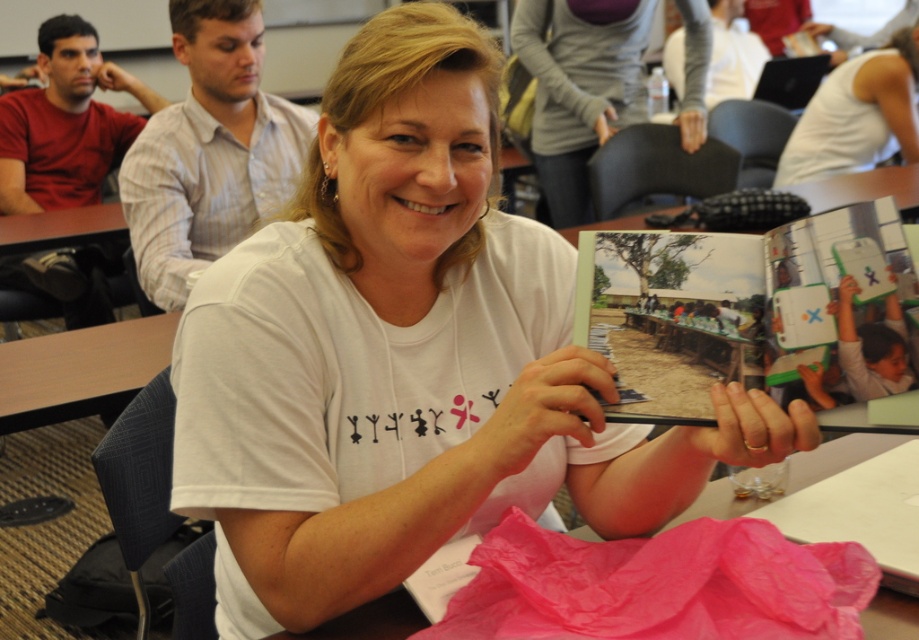
Is point (593, 253) positioned before point (112, 403)?

Yes, point (593, 253) is in front of point (112, 403).

Is green plastic book at center shorter than wooden table at lower left?

Indeed, green plastic book at center has a lesser height compared to wooden table at lower left.

The width and height of the screenshot is (919, 640). I want to click on green plastic book at center, so click(754, 316).

Who is positioned more to the right, white matte tank top at upper right or pink plastic bag at lower center?

white matte tank top at upper right is more to the right.

Does white matte tank top at upper right lie in front of pink plastic bag at lower center?

No, white matte tank top at upper right is further to the viewer.

Describe the element at coordinates (857, 115) in the screenshot. I see `white matte tank top at upper right` at that location.

The image size is (919, 640). Identify the location of white matte tank top at upper right. (857, 115).

Is wooden table at lower left taller than white matte tank top at upper right?

No, wooden table at lower left is not taller than white matte tank top at upper right.

Is point (30, 362) closer to camera compared to point (815, 161)?

Yes, it is in front of point (815, 161).

Which is behind, point (150, 355) or point (840, 67)?

The point (840, 67) is more distant.

At what (x,y) coordinates should I click in order to perform the action: click on wooden table at lower left. Please return your answer as a coordinate pair (x, y). The width and height of the screenshot is (919, 640). Looking at the image, I should click on (80, 371).